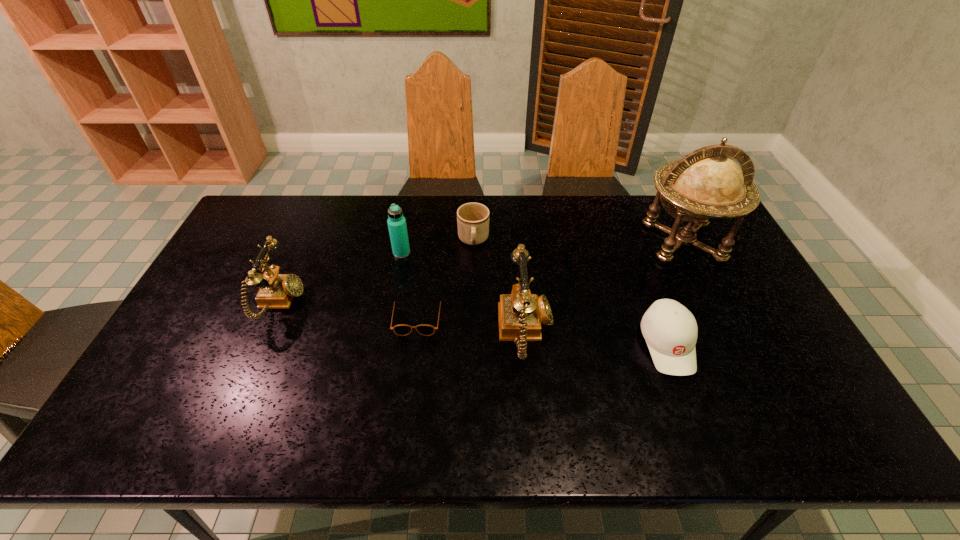
Where is `the left telephone`? This screenshot has width=960, height=540. the left telephone is located at coordinates (276, 291).

Where is `the leftmost object`? the leftmost object is located at coordinates (276, 291).

Locate an element on the screen. This screenshot has width=960, height=540. the right telephone is located at coordinates (520, 314).

Identify the location of the fifth object from left to right. (520, 314).

Where is `water bottle`? water bottle is located at coordinates (396, 221).

Locate an element on the screen. Image resolution: width=960 pixels, height=540 pixels. mug is located at coordinates (472, 218).

I want to click on globe, so click(x=706, y=183).

At what (x,y) coordinates should I click in order to perform the action: click on sunglasses. Please return your answer as a coordinate pair (x, y). The height and width of the screenshot is (540, 960). Looking at the image, I should click on (402, 330).

The height and width of the screenshot is (540, 960). I want to click on baseball cap, so [670, 330].

Locate an element on the screen. free space located 0.170m on the dial number of the left telephone is located at coordinates (360, 302).